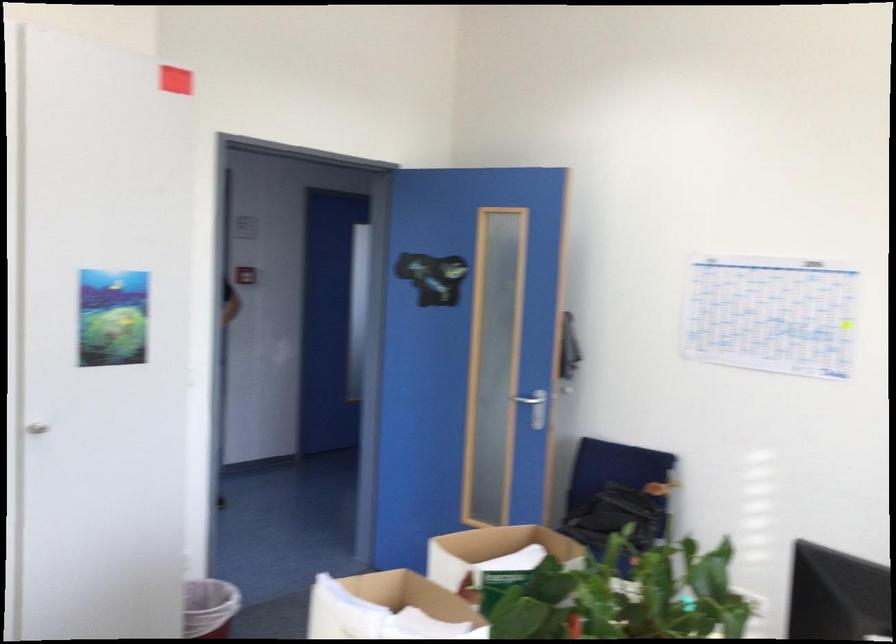
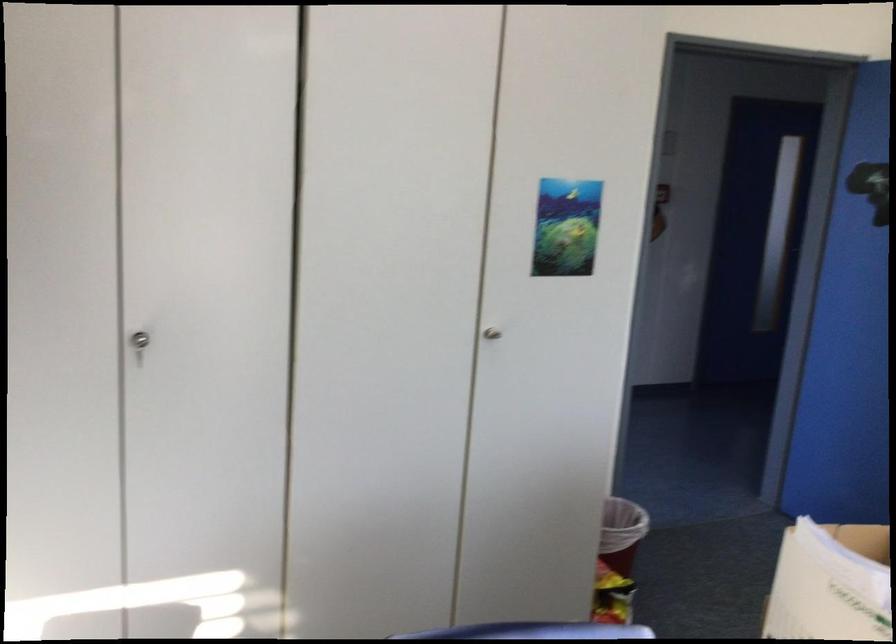
Question: The camera is either moving clockwise (left) or counter-clockwise (right) around the object. The first image is from the beginning of the video and the second image is from the end. Is the camera moving left or right when shooting the video?

Choices:
 (A) Left
 (B) Right

Answer: (B)